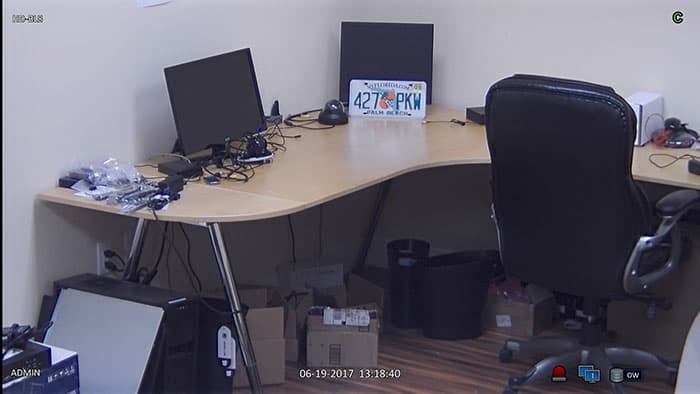
Image resolution: width=700 pixels, height=394 pixels. Find the location of `cardboard box`. cardboard box is located at coordinates (356, 341), (270, 338), (262, 303), (288, 302), (330, 284), (351, 286), (519, 298).